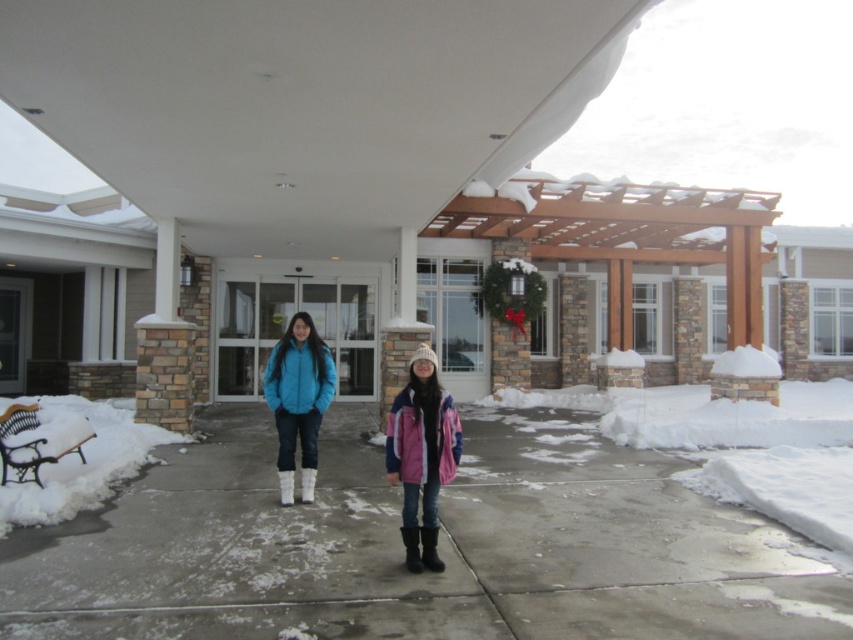
Who is lower down, concrete pavement at center or matte blue jacket at center?

Positioned lower is concrete pavement at center.

Who is more forward, (711, 579) or (306, 461)?

Point (711, 579)

Where is `concrete pavement at center`? The image size is (853, 640). concrete pavement at center is located at coordinates (402, 548).

Does pink fleece jacket at center have a smaller size compared to matte blue jacket at center?

Actually, pink fleece jacket at center might be larger than matte blue jacket at center.

Measure the distance between point [412,394] and camera.

Point [412,394] and camera are 5.28 meters apart.

Between point (410, 436) and point (325, 397), which one is positioned in front?

Point (410, 436)

Where is `pink fleece jacket at center`? The width and height of the screenshot is (853, 640). pink fleece jacket at center is located at coordinates (421, 456).

Can you confirm if concrete pavement at center is positioned above pink fleece jacket at center?

No, concrete pavement at center is not above pink fleece jacket at center.

In the scene shown: Can you confirm if concrete pavement at center is smaller than pink fleece jacket at center?

No.

Does point (801, 557) come farther from viewer compared to point (457, 436)?

Yes, point (801, 557) is behind point (457, 436).

You are a GUI agent. You are given a task and a screenshot of the screen. Output one action in this format:
    pyautogui.click(x=<x>, y=<y>)
    Task: Click on the concrete pavement at center
    
    Given the screenshot: What is the action you would take?
    402,548